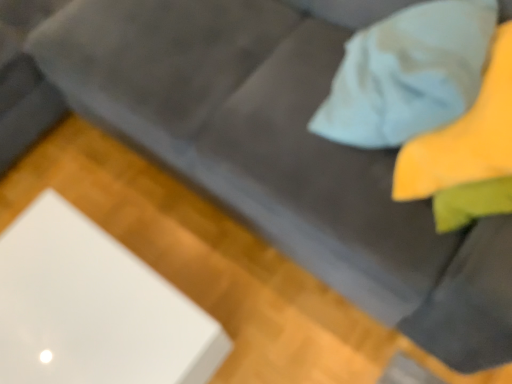
Question: Is yellow fabric pillow at upper right bigger or smaller than white glossy cube at lower left?

Choices:
 (A) big
 (B) small

Answer: (B)

Question: From a real-world perspective, is yellow fabric pillow at upper right above or below white glossy cube at lower left?

Choices:
 (A) above
 (B) below

Answer: (A)

Question: Do you think yellow fabric pillow at upper right is within white glossy cube at lower left, or outside of it?

Choices:
 (A) inside
 (B) outside

Answer: (B)

Question: Choose the correct answer: Is white glossy cube at lower left inside yellow fabric pillow at upper right or outside it?

Choices:
 (A) inside
 (B) outside

Answer: (B)

Question: Is white glossy cube at lower left wider or thinner than yellow fabric pillow at upper right?

Choices:
 (A) wide
 (B) thin

Answer: (A)

Question: Is white glossy cube at lower left bigger or smaller than yellow fabric pillow at upper right?

Choices:
 (A) small
 (B) big

Answer: (B)

Question: From the image's perspective, is white glossy cube at lower left above or below yellow fabric pillow at upper right?

Choices:
 (A) below
 (B) above

Answer: (A)